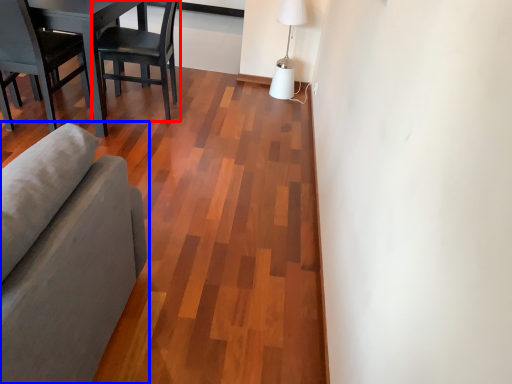
Question: Which point is closer to the camera, chair (highlighted by a red box) or studio couch (highlighted by a blue box)?

Choices:
 (A) chair
 (B) studio couch

Answer: (B)